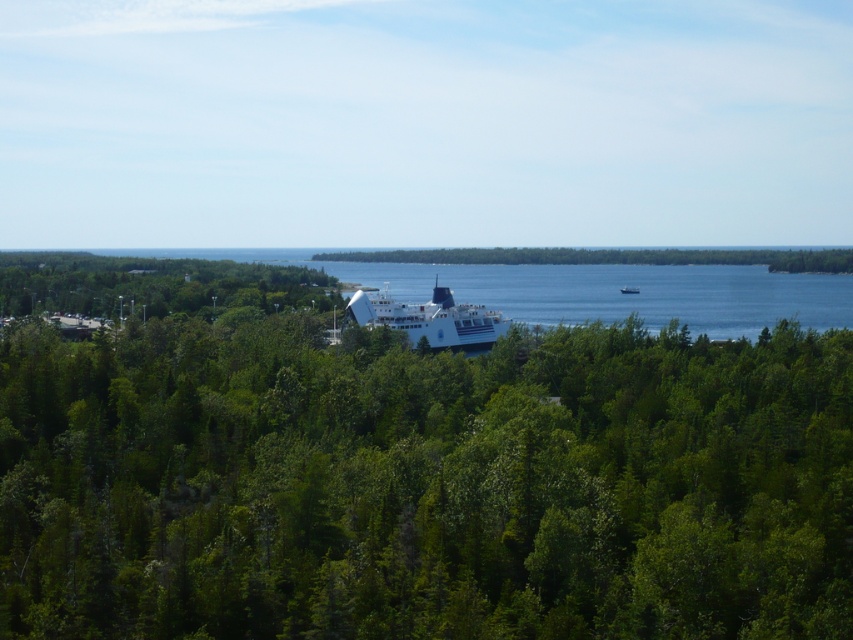
Question: Among these points, which one is farthest from the camera?

Choices:
 (A) (646, 307)
 (B) (375, 291)
 (C) (628, 289)
 (D) (163, 422)

Answer: (A)

Question: Which object is the farthest from the green leafy trees at center?

Choices:
 (A) white glossy ship at center
 (B) blue water at center

Answer: (A)

Question: From the image, what is the correct spatial relationship of green leafy trees at center in relation to blue water at center?

Choices:
 (A) right
 (B) left

Answer: (B)

Question: Does blue water at center appear over white glossy cruise ship at center?

Choices:
 (A) no
 (B) yes

Answer: (B)

Question: Can you confirm if green leafy trees at center is positioned to the right of blue water at center?

Choices:
 (A) yes
 (B) no

Answer: (B)

Question: Which point is farther to the camera?

Choices:
 (A) white glossy ship at center
 (B) white glossy cruise ship at center
 (C) green leafy trees at center

Answer: (A)